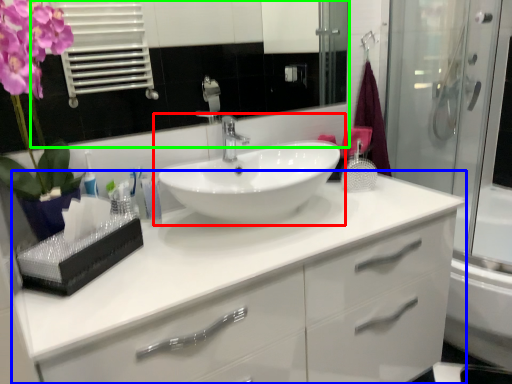
Question: Estimate the real-world distances between objects in this image. Which object is farther from sink (highlighted by a red box), bathroom cabinet (highlighted by a blue box) or mirror (highlighted by a green box)?

Choices:
 (A) bathroom cabinet
 (B) mirror

Answer: (B)